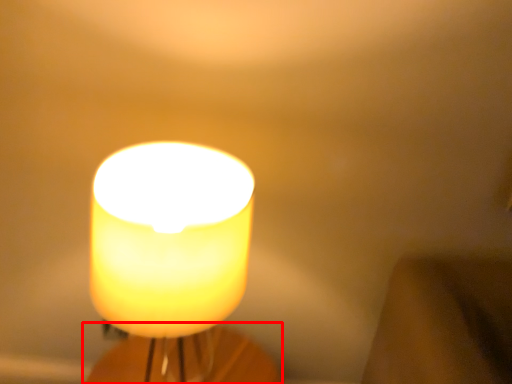
Question: From the image's perspective, considering the relative positions of candle holder (annotated by the red box) and candle in the image provided, where is candle holder (annotated by the red box) located with respect to the staircase?

Choices:
 (A) below
 (B) above

Answer: (A)